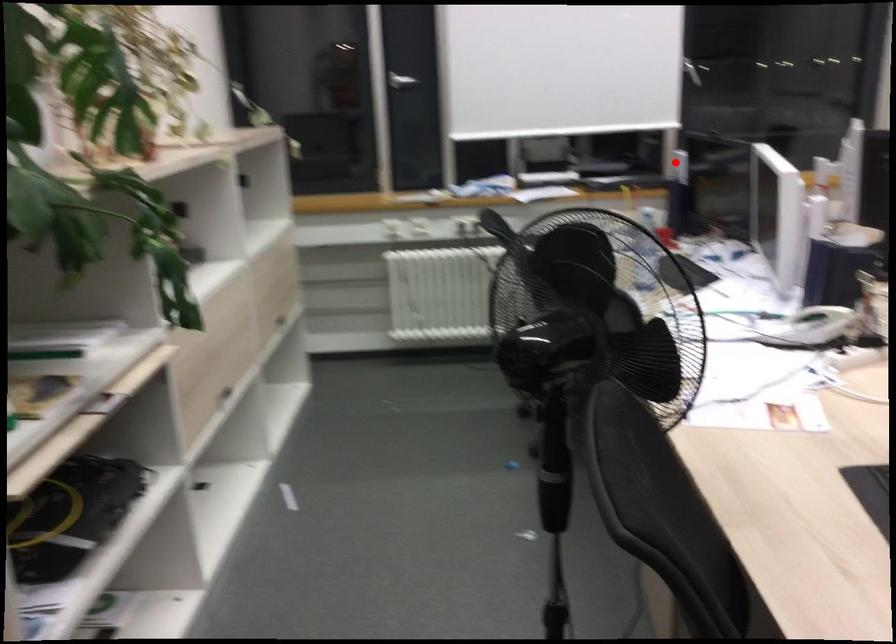
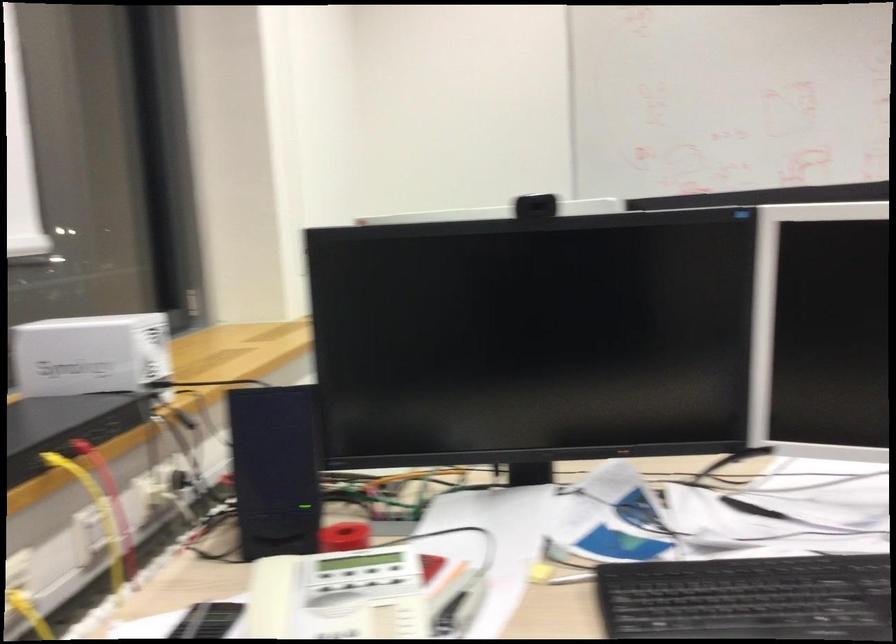
Locate, in the second image, the point that corresponds to the highlighted location in the first image.

(90, 354)